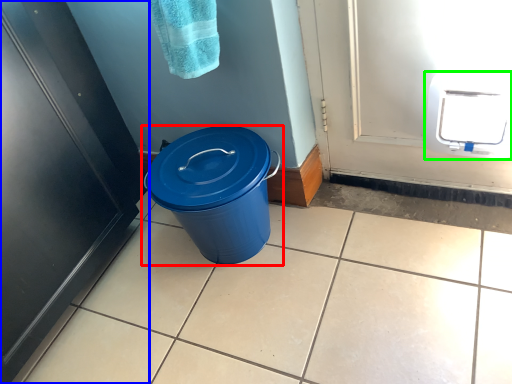
Question: Considering the real-world distances, which object is farthest from waste container (highlighted by a red box)? door (highlighted by a blue box) or appliance (highlighted by a green box)?

Choices:
 (A) door
 (B) appliance

Answer: (B)